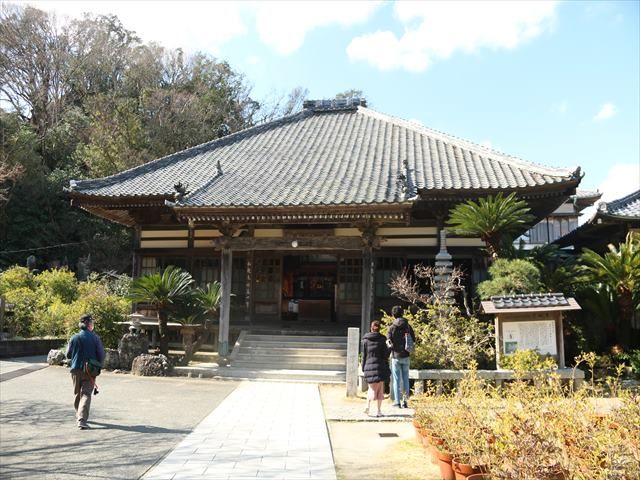
Where is `staircase`? staircase is located at coordinates (300, 353).